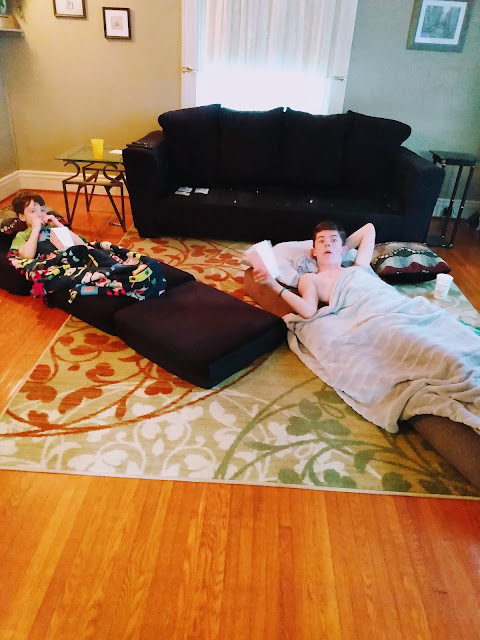
Image resolution: width=480 pixels, height=640 pixels. What are the coordinates of `sofa` in the screenshot? It's located at (276, 189).